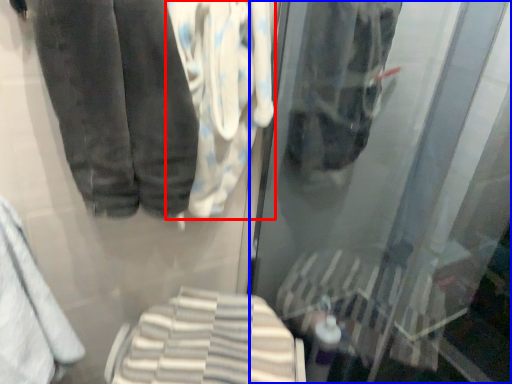
Question: Among these objects, which one is nearest to the camera, cloth (highlighted by a red box) or shop window (highlighted by a blue box)?

Choices:
 (A) cloth
 (B) shop window

Answer: (B)